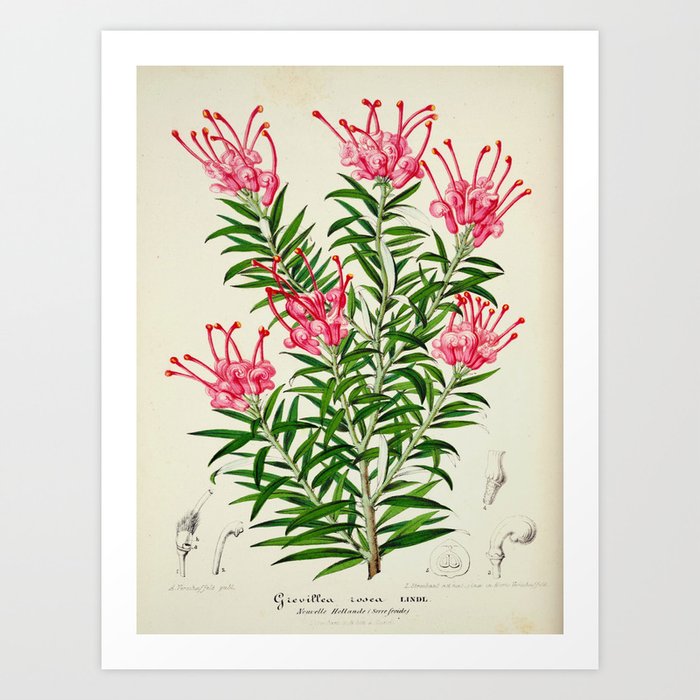
Where is `picture`? The width and height of the screenshot is (700, 700). picture is located at coordinates (350, 62).